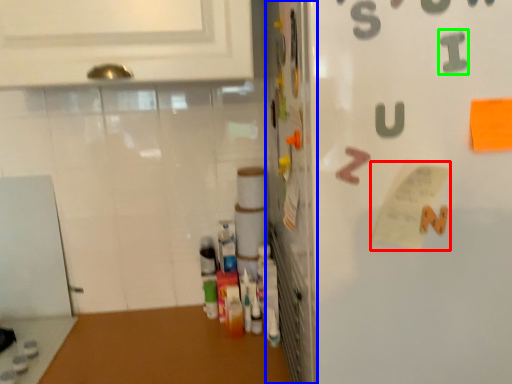
Question: Based on their relative distances, which object is farther from paper (highlighted by a red box)? Choose from door (highlighted by a blue box) and alphabet (highlighted by a green box).

Choices:
 (A) door
 (B) alphabet

Answer: (A)